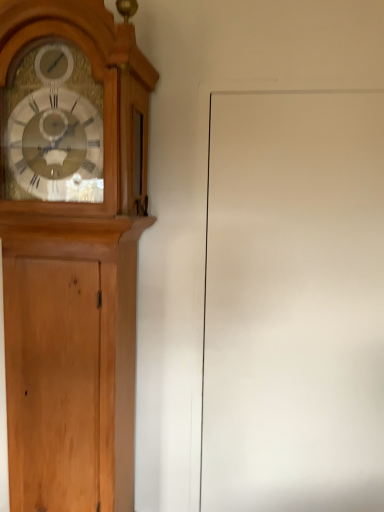
This screenshot has width=384, height=512. I want to click on wooden wall clock at left, so click(x=71, y=249).

The width and height of the screenshot is (384, 512). Describe the element at coordinates (71, 249) in the screenshot. I see `wooden wall clock at left` at that location.

Locate an element on the screen. wooden wall clock at left is located at coordinates (71, 249).